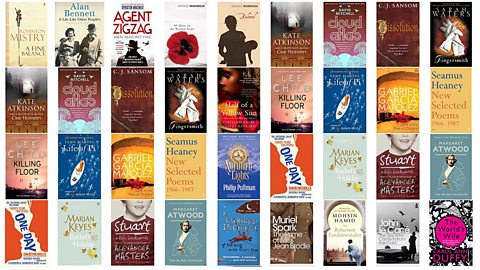
The height and width of the screenshot is (270, 480). I want to click on white space between books, so click(x=317, y=169), click(x=425, y=173), click(x=372, y=174), click(x=265, y=165), click(x=210, y=167), click(x=160, y=159), click(x=103, y=165), click(x=52, y=173).